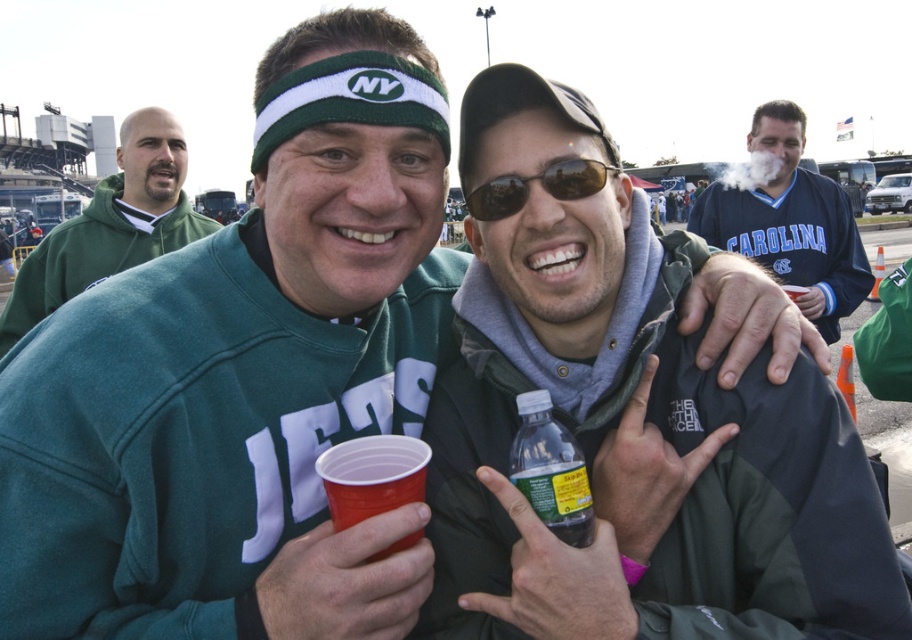
You are at a sports event and want to place both the translucent plastic bottle at center and the sunglasses at center into a small cup holder. Based on their sizes, which one is more likely to fit?

The sunglasses at center are narrower than the translucent plastic bottle at center, so the sunglasses at center are more likely to fit into the small cup holder.

What is the position of the blue jersey at upper right in the image?

The blue jersey at upper right is located at point (790, 221).